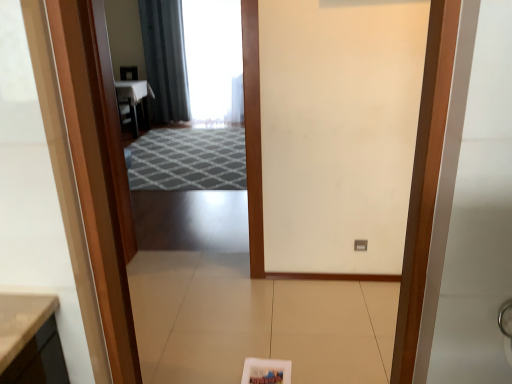
Question: Considering the relative sizes of gray textured rug at center and dark gray fabric curtain at upper center in the image provided, is gray textured rug at center taller than dark gray fabric curtain at upper center?

Choices:
 (A) no
 (B) yes

Answer: (A)

Question: Is gray textured rug at center closer to camera compared to dark gray fabric curtain at upper center?

Choices:
 (A) yes
 (B) no

Answer: (A)

Question: From the image's perspective, does gray textured rug at center appear lower than dark gray fabric curtain at upper center?

Choices:
 (A) yes
 (B) no

Answer: (A)

Question: Is gray textured rug at center further to the viewer compared to dark gray fabric curtain at upper center?

Choices:
 (A) no
 (B) yes

Answer: (A)

Question: From a real-world perspective, is gray textured rug at center located beneath dark gray fabric curtain at upper center?

Choices:
 (A) no
 (B) yes

Answer: (B)

Question: Is gray textured rug at center in front of or behind dark gray fabric curtain at upper center in the image?

Choices:
 (A) behind
 (B) front

Answer: (B)

Question: From the image's perspective, relative to dark gray fabric curtain at upper center, is gray textured rug at center above or below?

Choices:
 (A) above
 (B) below

Answer: (B)

Question: Based on their positions, is gray textured rug at center located to the left or right of dark gray fabric curtain at upper center?

Choices:
 (A) right
 (B) left

Answer: (A)

Question: In terms of width, does gray textured rug at center look wider or thinner when compared to dark gray fabric curtain at upper center?

Choices:
 (A) wide
 (B) thin

Answer: (A)

Question: Looking at the image, does wooden door at center seem bigger or smaller compared to dark gray fabric curtain at upper center?

Choices:
 (A) small
 (B) big

Answer: (A)

Question: Considering the positions of wooden door at center and dark gray fabric curtain at upper center in the image, is wooden door at center taller or shorter than dark gray fabric curtain at upper center?

Choices:
 (A) tall
 (B) short

Answer: (B)

Question: Does point (52, 6) appear closer or farther from the camera than point (160, 69)?

Choices:
 (A) farther
 (B) closer

Answer: (B)

Question: From a real-world perspective, is wooden door at center positioned above or below dark gray fabric curtain at upper center?

Choices:
 (A) above
 (B) below

Answer: (B)

Question: Is point (80, 196) positioned closer to the camera than point (203, 165)?

Choices:
 (A) closer
 (B) farther

Answer: (A)

Question: Relative to gray textured rug at center, is wooden door at center in front or behind?

Choices:
 (A) front
 (B) behind

Answer: (A)